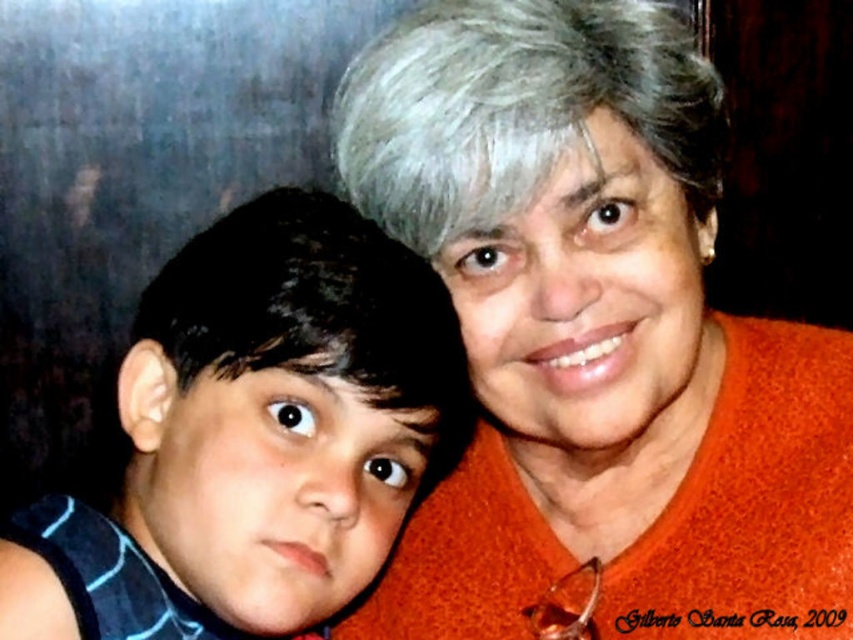
Based on the photo, you are standing in front of the image and notice a point at coordinates (595, 340). What object is located at this point?

The orange fabric at upper right is located at point (595, 340).

You are a photographer trying to adjust the lighting for a portrait. You notice the gray matte hair at upper center and the orange fabric at upper right. Which object is closer to the camera?

The orange fabric at upper right is closer to the camera than the gray matte hair at upper center because the gray matte hair is positioned behind the orange fabric.